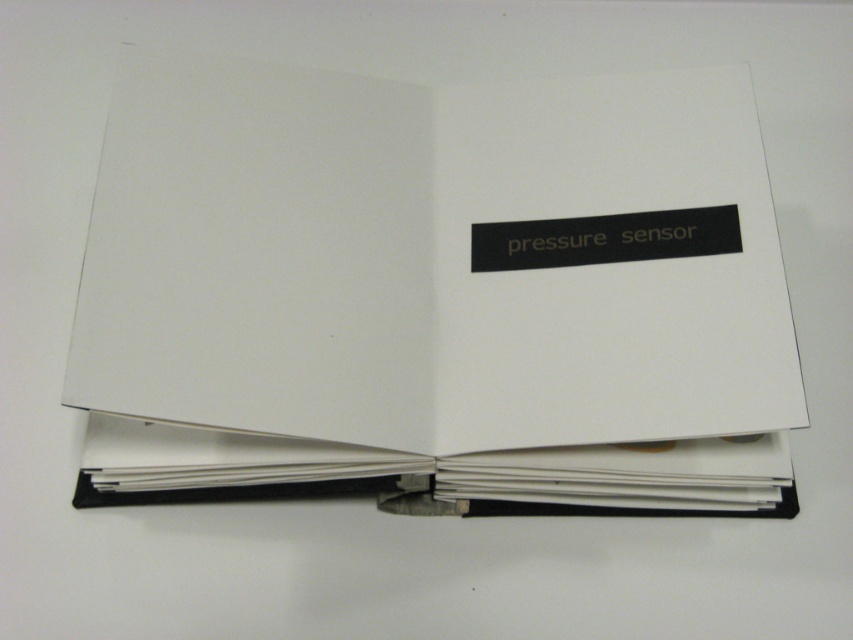
Can you confirm if white paper journal at center is positioned above white paper binder at lower center?

Yes.

Between white paper journal at center and white paper binder at lower center, which one is positioned lower?

white paper binder at lower center is below.

Find the location of `white paper journal at center`. white paper journal at center is located at coordinates (436, 291).

At what (x,y) coordinates should I click in order to perform the action: click on white paper journal at center. Please return your answer as a coordinate pair (x, y). The image size is (853, 640). Looking at the image, I should click on (436, 291).